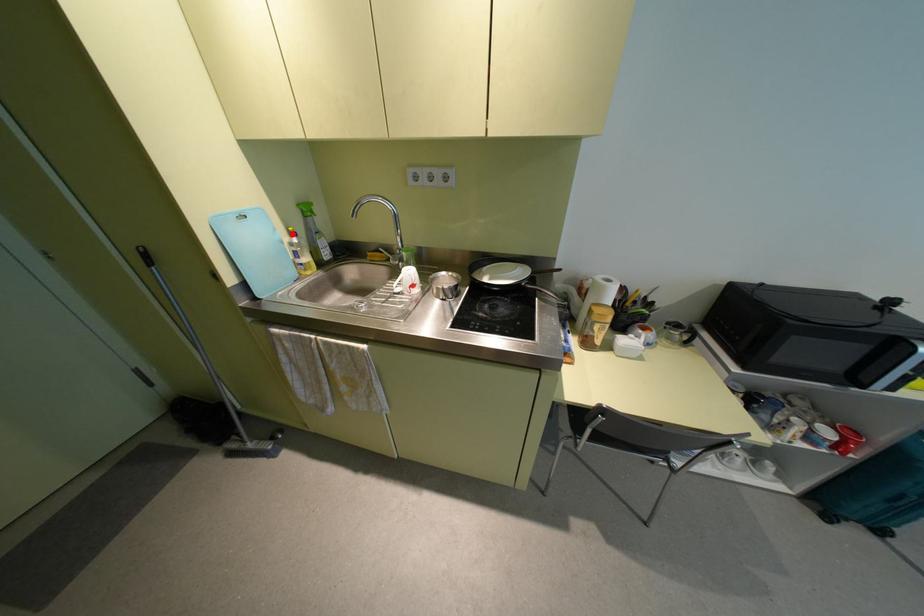
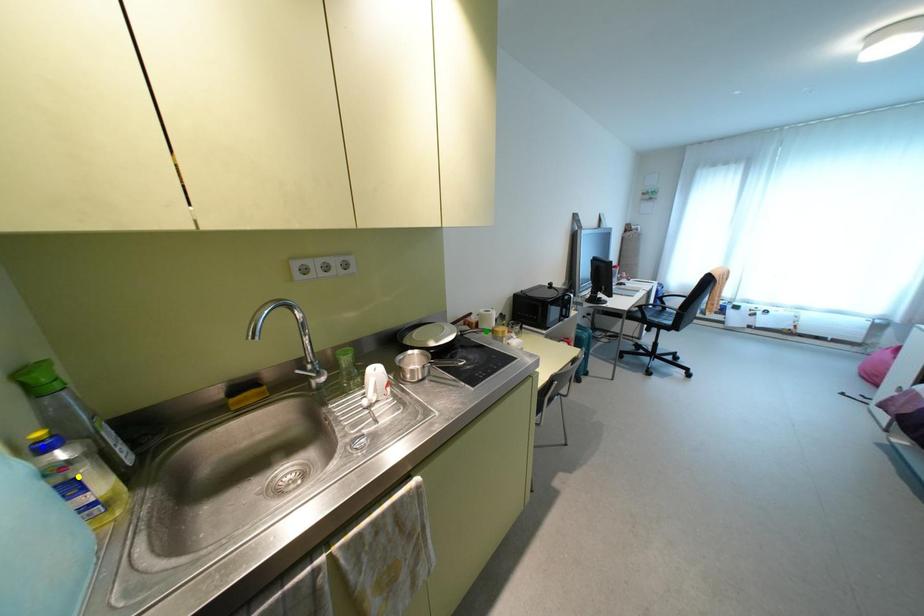
Question: I am providing you with two images of the same scene from different viewpoints. A red point is marked on the first image. You are given multiple points on the second image. Which point in image 2 is actually the same real-world point as the red point in image 1?

Choices:
 (A) yellow point
 (B) green point
 (C) blue point

Answer: (C)